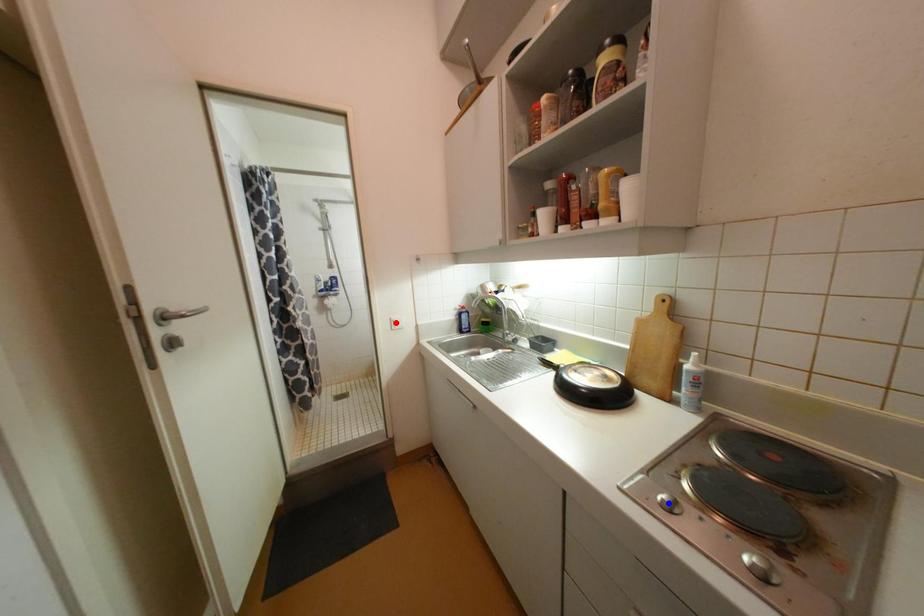
Question: In the image, two points are highlighted. Which point is nearer to the camera? Reply with the corresponding letter.

Choices:
 (A) blue point
 (B) red point

Answer: (A)